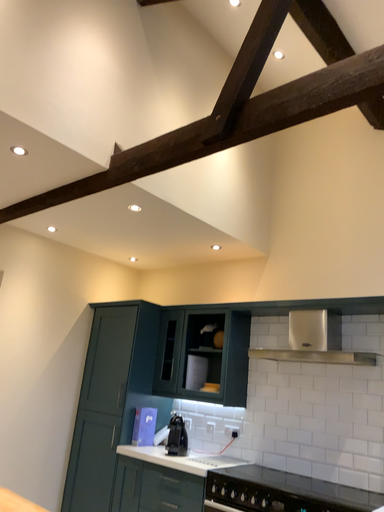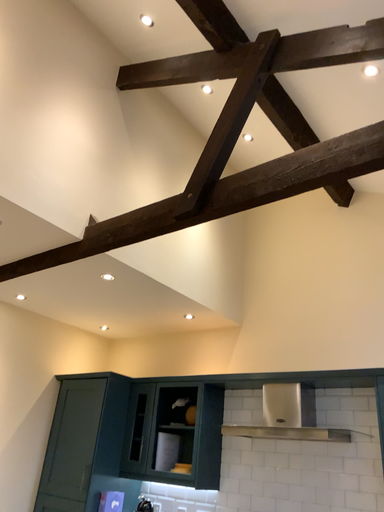
Question: How did the camera likely rotate when shooting the video?

Choices:
 (A) rotated downward
 (B) rotated upward

Answer: (B)